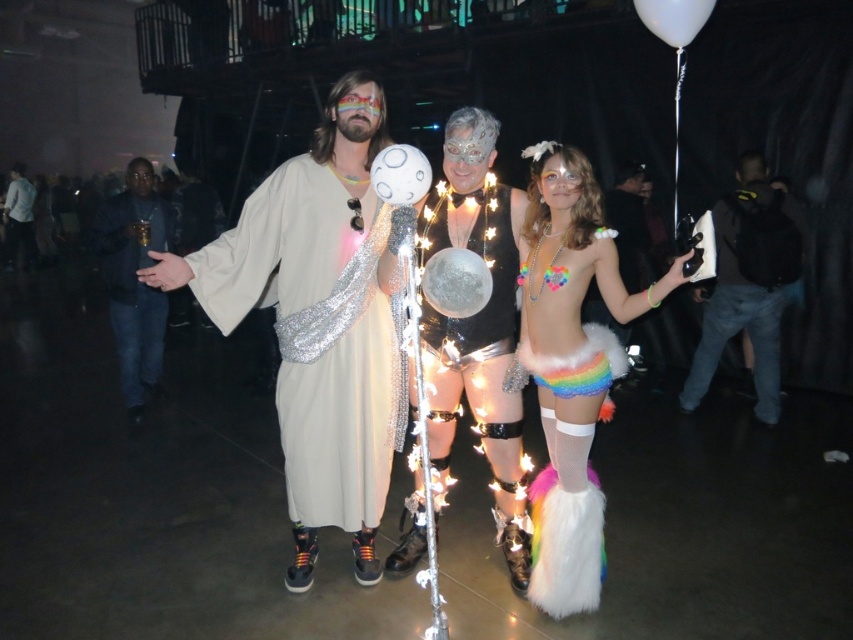
Based on the photo, who is taller, rainbow fabric bikini at center or white glossy balloon at upper right?

With more height is rainbow fabric bikini at center.

Looking at this image, who is more forward, [543,259] or [648,19]?

Point [648,19] is in front.

Identify the location of rainbow fabric bikini at center. Image resolution: width=853 pixels, height=640 pixels. [x=572, y=365].

Is black leather jacket at right taller than white glossy balloon at upper right?

Yes, black leather jacket at right is taller than white glossy balloon at upper right.

Is black leather jacket at right thinner than white glossy balloon at upper right?

In fact, black leather jacket at right might be wider than white glossy balloon at upper right.

The width and height of the screenshot is (853, 640). What are the coordinates of `black leather jacket at right` in the screenshot? It's located at (747, 284).

Between white sequined robe at center and glittery metallic ball at center, which one appears on the left side from the viewer's perspective?

white sequined robe at center is more to the left.

Is white sequined robe at center smaller than glittery metallic ball at center?

Actually, white sequined robe at center might be larger than glittery metallic ball at center.

Which is in front, point (351, 308) or point (434, 314)?

Point (351, 308) is in front.

At what (x,y) coordinates should I click in order to perform the action: click on white sequined robe at center. Please return your answer as a coordinate pair (x, y). The height and width of the screenshot is (640, 853). Looking at the image, I should click on (318, 336).